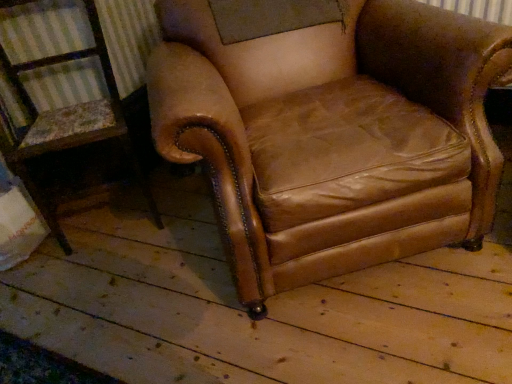
Question: From a real-world perspective, relative to brown leather armchair at center, which is the 1th chair from left to right, is brown leather armchair at center, marked as the 1th chair in a right-to-left arrangement, vertically above or below?

Choices:
 (A) below
 (B) above

Answer: (B)

Question: Is brown leather armchair at center, marked as the 1th chair in a right-to-left arrangement, in front of or behind brown leather armchair at center, which is the 2th chair in right-to-left order, in the image?

Choices:
 (A) behind
 (B) front

Answer: (B)

Question: Which is correct: brown leather armchair at center, which is counted as the second chair, starting from the left, is inside brown leather armchair at center, which is the 2th chair in right-to-left order, or outside of it?

Choices:
 (A) outside
 (B) inside

Answer: (A)

Question: Relative to brown leather armchair at center, which is counted as the second chair, starting from the left, is brown leather armchair at center, which is the 2th chair in right-to-left order, in front or behind?

Choices:
 (A) front
 (B) behind

Answer: (B)

Question: Which is correct: brown leather armchair at center, which is the 2th chair in right-to-left order, is inside brown leather armchair at center, which is counted as the second chair, starting from the left, or outside of it?

Choices:
 (A) inside
 (B) outside

Answer: (B)

Question: Would you say brown leather armchair at center, which is the 1th chair from left to right, is to the left or to the right of brown leather armchair at center, marked as the 1th chair in a right-to-left arrangement, in the picture?

Choices:
 (A) right
 (B) left

Answer: (B)

Question: Considering the positions of brown leather armchair at center, which is the 2th chair in right-to-left order, and brown leather armchair at center, which is counted as the second chair, starting from the left, in the image, is brown leather armchair at center, which is the 2th chair in right-to-left order, taller or shorter than brown leather armchair at center, which is counted as the second chair, starting from the left,?

Choices:
 (A) tall
 (B) short

Answer: (B)